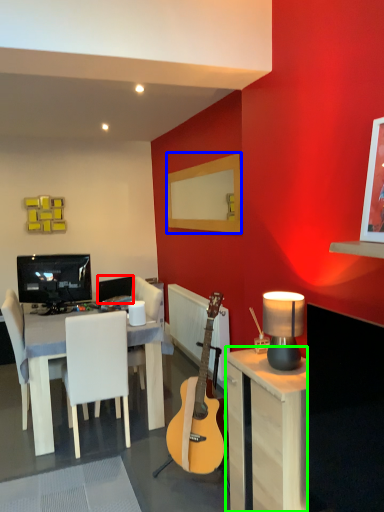
Question: Which is nearer to the television (highlighted by a red box)? mirror (highlighted by a blue box) or desk (highlighted by a green box).

Choices:
 (A) mirror
 (B) desk

Answer: (A)